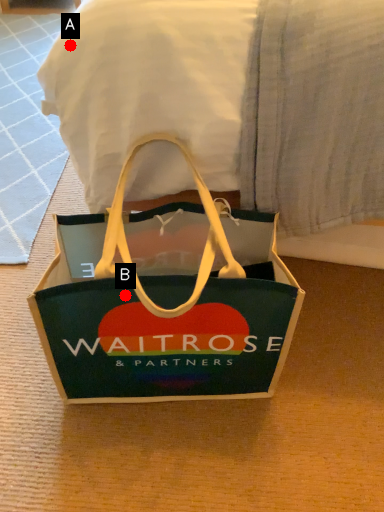
Question: Two points are circled on the image, labeled by A and B beside each circle. Which of the following is the closest to the observer?

Choices:
 (A) A is closer
 (B) B is closer

Answer: (A)